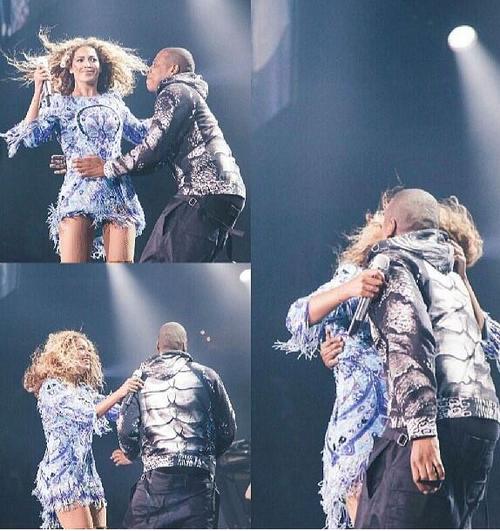
Find the location of `hood`. hood is located at coordinates (431, 255), (161, 367), (193, 82).